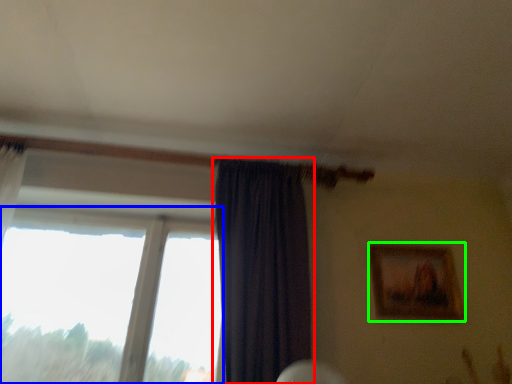
Question: Based on their relative distances, which object is farther from curtain (highlighted by a red box)? Choose from window (highlighted by a blue box) and picture frame (highlighted by a green box).

Choices:
 (A) window
 (B) picture frame

Answer: (B)